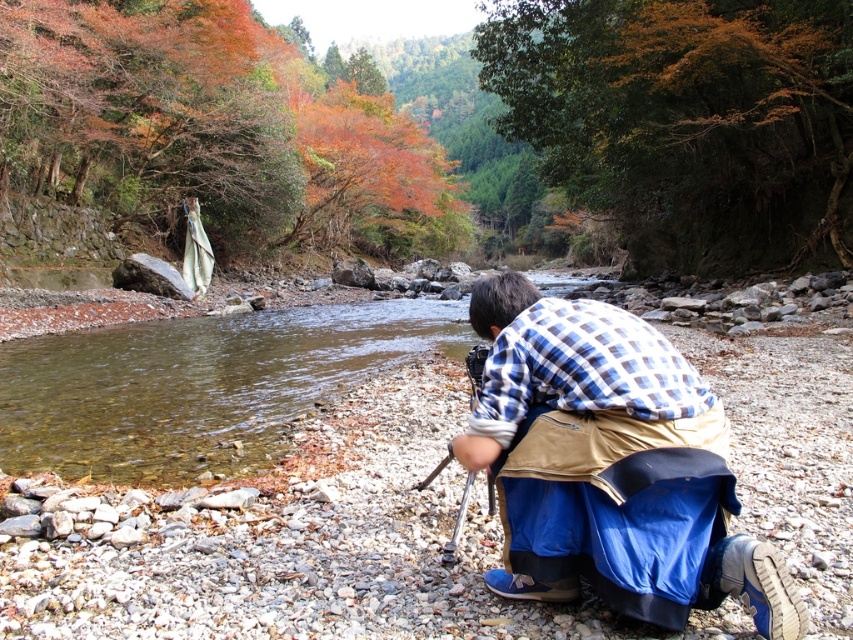
Question: Is blue plaid shirt at center wider than clear water at stream center?

Choices:
 (A) yes
 (B) no

Answer: (B)

Question: Is blue plaid shirt at center smaller than clear water at stream center?

Choices:
 (A) yes
 (B) no

Answer: (A)

Question: Which of the following is the closest to the observer?

Choices:
 (A) (120, 353)
 (B) (498, 470)

Answer: (B)

Question: Which point is farther to the camera?

Choices:
 (A) (90, 365)
 (B) (616, 445)

Answer: (A)

Question: Is blue plaid shirt at center positioned behind clear water at stream center?

Choices:
 (A) no
 (B) yes

Answer: (A)

Question: Which of the following is the farthest from the observer?

Choices:
 (A) (51, 417)
 (B) (697, 458)

Answer: (A)